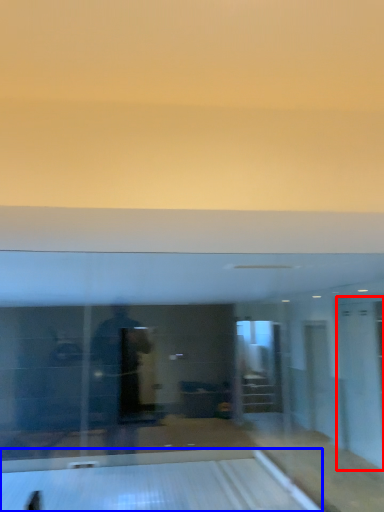
Question: Among these objects, which one is nearest to the camera, glass door (highlighted by a red box) or bowling alley (highlighted by a blue box)?

Choices:
 (A) glass door
 (B) bowling alley

Answer: (B)